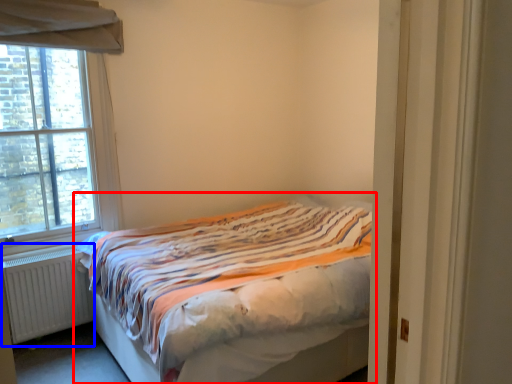
Question: Which object appears closest to the camera in this image, bed (highlighted by a red box) or radiator (highlighted by a blue box)?

Choices:
 (A) bed
 (B) radiator

Answer: (A)